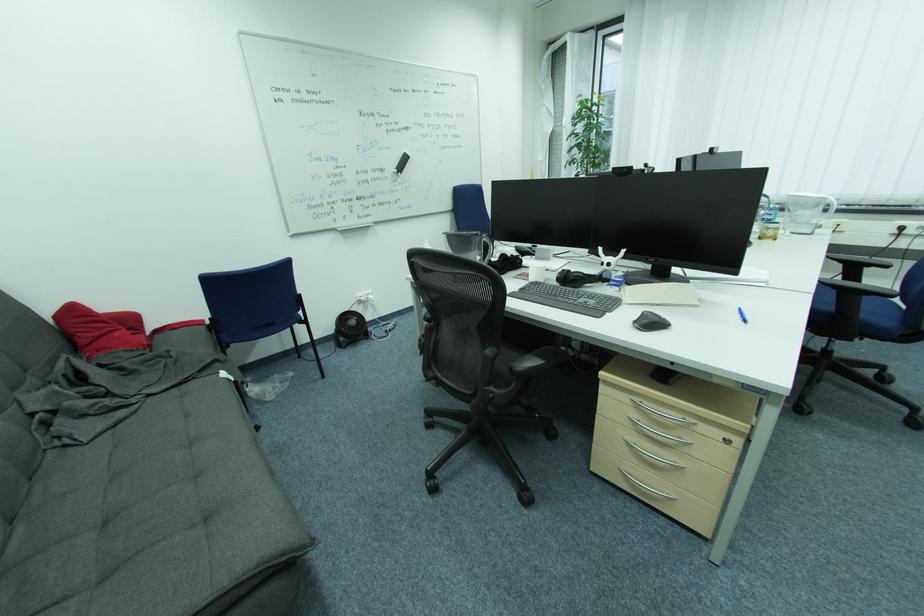
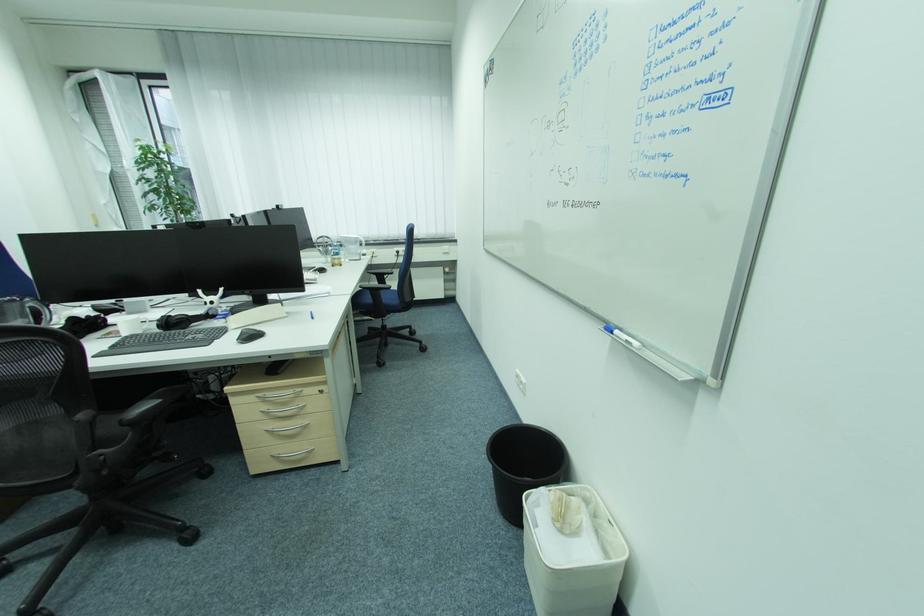
Find the pixel in the second image that matches (495,387) in the first image.

(102, 452)